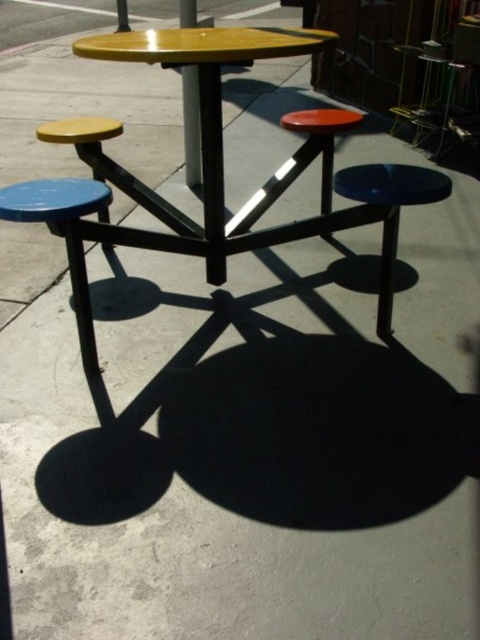
Is blue painted metal stool at left taller than matte yellow stool at left?

Correct, blue painted metal stool at left is much taller as matte yellow stool at left.

Which is behind, point (67, 180) or point (109, 129)?

Positioned behind is point (109, 129).

Image resolution: width=480 pixels, height=640 pixels. I want to click on blue painted metal stool at left, so click(62, 236).

Which is above, blue matte stool at center or yellow matte pole at center?

Positioned higher is yellow matte pole at center.

Between point (424, 182) and point (190, 10), which one is positioned in front?

Point (424, 182)

What are the coordinates of `blue matte stool at center` in the screenshot? It's located at (389, 212).

Between point (381, 282) and point (117, 4), which one is positioned behind?

Point (117, 4)

Can you confirm if blue matte stool at center is thinner than metallic pole at upper center?

Yes, blue matte stool at center is thinner than metallic pole at upper center.

Is point (373, 177) less distant than point (127, 28)?

Yes, it is.

Find the location of `blue matte stool at center`. blue matte stool at center is located at coordinates tap(389, 212).